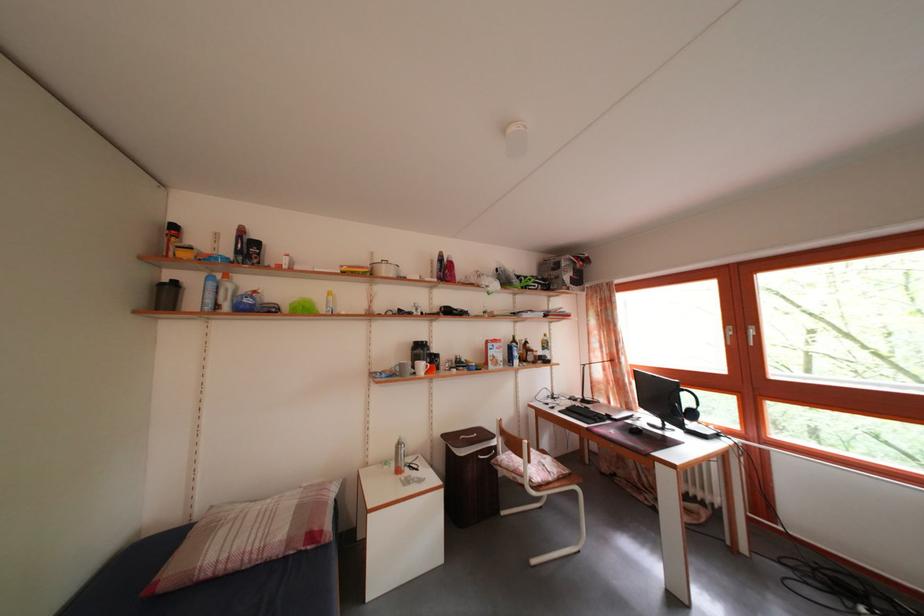
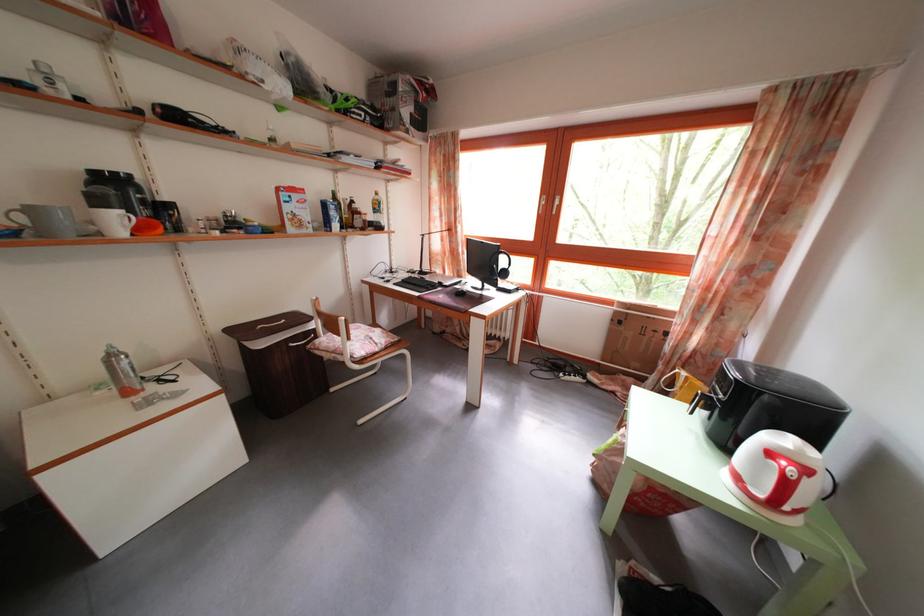
Where in the second image is the point corresponding to the point at 428,488 from the first image?

(185, 402)